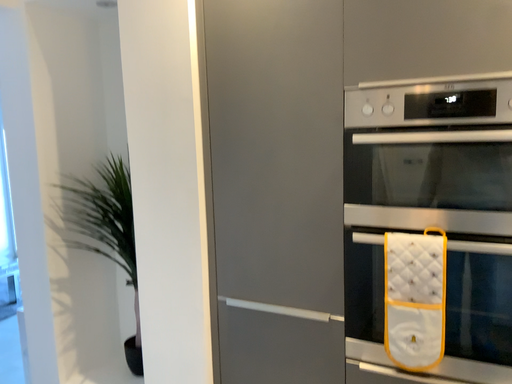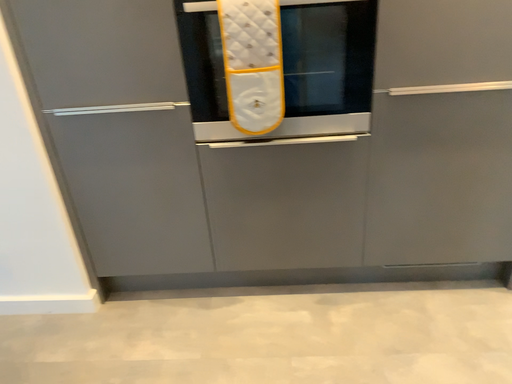
Question: How did the camera likely rotate when shooting the video?

Choices:
 (A) rotated downward
 (B) rotated upward

Answer: (A)